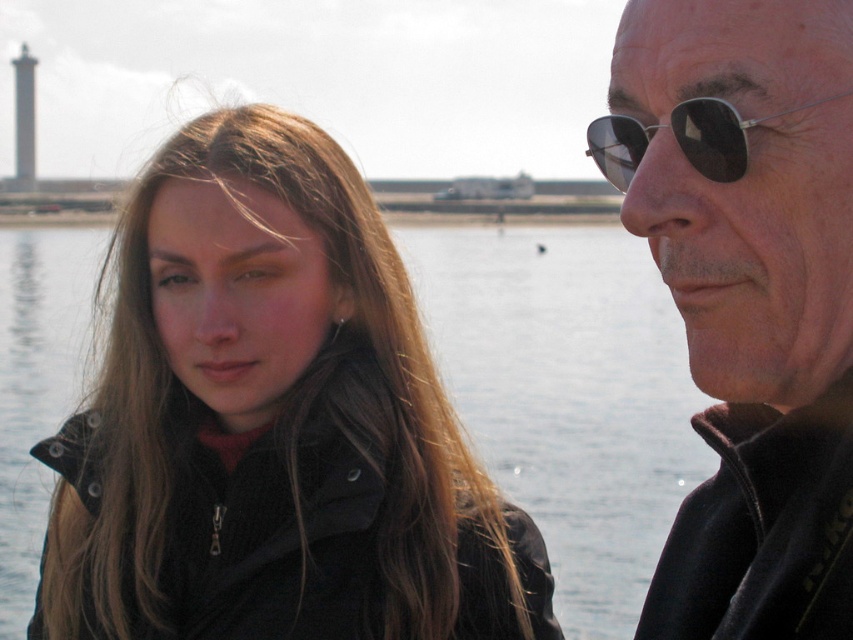
Measure the distance between point (x=299, y=211) and camera.

The distance of point (x=299, y=211) from camera is 43.74 meters.

Does matte black jacket at left appear over black matte sunglasses at upper right?

No, matte black jacket at left is not above black matte sunglasses at upper right.

Find the location of a particular element. matte black jacket at left is located at coordinates (273, 422).

Between black matte sunglasses at upper right and sunglasses at right, which one appears on the right side from the viewer's perspective?

From the viewer's perspective, black matte sunglasses at upper right appears more on the right side.

Does point (834, 605) lie behind point (610, 120)?

No, it is in front of (610, 120).

Which is behind, point (764, 204) or point (630, 172)?

Point (630, 172)

This screenshot has width=853, height=640. I want to click on black matte sunglasses at upper right, so pos(747,296).

Is matte black jacket at left wider than sunglasses at right?

Indeed, matte black jacket at left has a greater width compared to sunglasses at right.

How much distance is there between matte black jacket at left and sunglasses at right?

matte black jacket at left and sunglasses at right are 17.02 meters apart.

This screenshot has height=640, width=853. What do you see at coordinates (273, 422) in the screenshot? I see `matte black jacket at left` at bounding box center [273, 422].

Locate an element on the screen. Image resolution: width=853 pixels, height=640 pixels. matte black jacket at left is located at coordinates (273, 422).